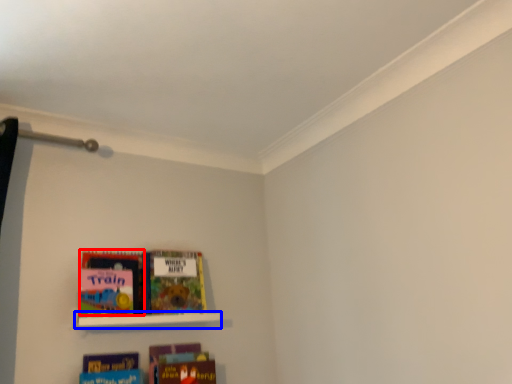
Question: Which point is further to the camera, book (highlighted by a red box) or shelf (highlighted by a blue box)?

Choices:
 (A) book
 (B) shelf

Answer: (A)